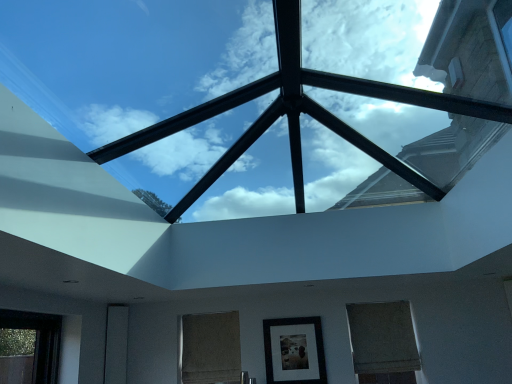
Question: Considering the relative positions of matte black picture frame at center and burlap curtain at center, which is counted as the 1th window, starting from the left, in the image provided, is matte black picture frame at center behind burlap curtain at center, which is counted as the 1th window, starting from the left,?

Choices:
 (A) no
 (B) yes

Answer: (A)

Question: Is matte black picture frame at center facing away from burlap curtain at center, the 2th window in the right-to-left sequence?

Choices:
 (A) yes
 (B) no

Answer: (B)

Question: Can you confirm if matte black picture frame at center is positioned to the right of burlap curtain at center, which is counted as the 1th window, starting from the left?

Choices:
 (A) no
 (B) yes

Answer: (B)

Question: From a real-world perspective, is matte black picture frame at center positioned under burlap curtain at center, the 2th window in the right-to-left sequence, based on gravity?

Choices:
 (A) no
 (B) yes

Answer: (B)

Question: Is matte black picture frame at center oriented towards burlap curtain at center, which is counted as the 1th window, starting from the left?

Choices:
 (A) yes
 (B) no

Answer: (B)

Question: In terms of height, does transparent glass skylight at center look taller or shorter compared to matte brown blind at lower right, the 2th window positioned from the left?

Choices:
 (A) short
 (B) tall

Answer: (A)

Question: Would you say transparent glass skylight at center is to the left or to the right of matte brown blind at lower right, the 2th window positioned from the left, in the picture?

Choices:
 (A) right
 (B) left

Answer: (B)

Question: Considering the positions of point (292, 62) and point (356, 367), is point (292, 62) closer or farther from the camera than point (356, 367)?

Choices:
 (A) farther
 (B) closer

Answer: (B)

Question: Is transparent glass skylight at center bigger or smaller than matte brown blind at lower right, the 2th window positioned from the left?

Choices:
 (A) small
 (B) big

Answer: (B)

Question: In terms of width, does matte black glass door at lower left look wider or thinner when compared to transparent glass skylight at center?

Choices:
 (A) wide
 (B) thin

Answer: (B)

Question: Based on their sizes in the image, would you say matte black glass door at lower left is bigger or smaller than transparent glass skylight at center?

Choices:
 (A) small
 (B) big

Answer: (A)

Question: Relative to transparent glass skylight at center, is matte black glass door at lower left in front or behind?

Choices:
 (A) behind
 (B) front

Answer: (A)

Question: In terms of height, does matte black glass door at lower left look taller or shorter compared to transparent glass skylight at center?

Choices:
 (A) tall
 (B) short

Answer: (A)

Question: In terms of width, does matte black picture frame at center look wider or thinner when compared to transparent glass skylight at center?

Choices:
 (A) thin
 (B) wide

Answer: (A)

Question: Would you say matte black picture frame at center is inside or outside transparent glass skylight at center?

Choices:
 (A) inside
 (B) outside

Answer: (B)